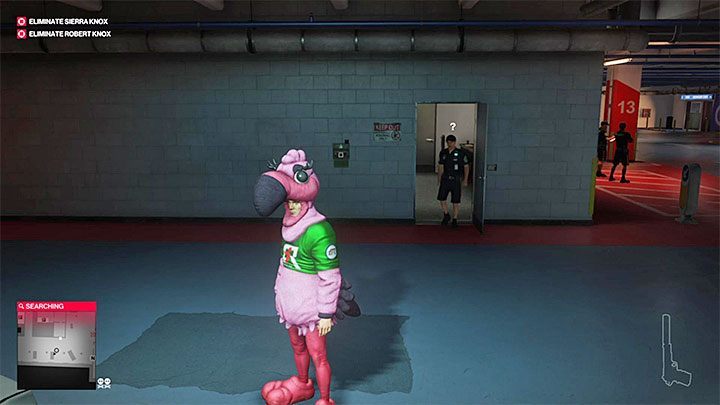
Locate an element on the screen. Image resolution: width=720 pixels, height=405 pixels. fire alarm is located at coordinates (338, 162).